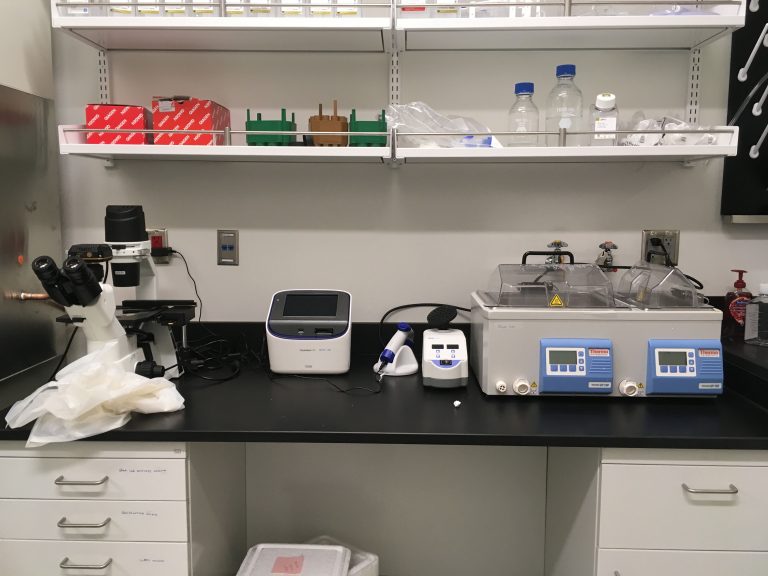
I want to click on hand soap, so click(x=740, y=300).